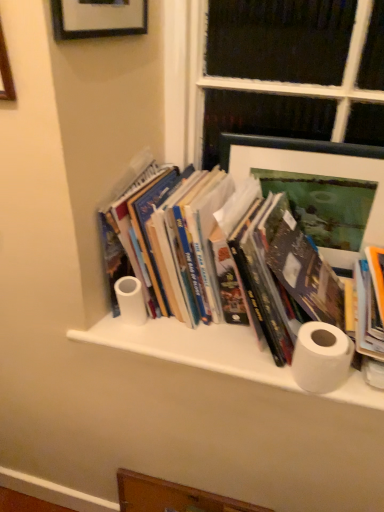
Question: Can you confirm if matte green picture frame at upper right, the 2th picture frame positioned from the front, is positioned to the right of brushed metal picture frame at upper left, the second picture frame from the bottom?

Choices:
 (A) no
 (B) yes

Answer: (B)

Question: Is matte green picture frame at upper right, which is counted as the first picture frame, starting from the right, located outside brushed metal picture frame at upper left, the second picture frame from the bottom?

Choices:
 (A) yes
 (B) no

Answer: (A)

Question: Could you tell me if matte green picture frame at upper right, the 2th picture frame viewed from the top, is turned towards brushed metal picture frame at upper left, the second picture frame from the bottom?

Choices:
 (A) yes
 (B) no

Answer: (B)

Question: Is the position of matte green picture frame at upper right, which appears as the first picture frame when viewed from the back, less distant than that of brushed metal picture frame at upper left, acting as the second picture frame starting from the right?

Choices:
 (A) no
 (B) yes

Answer: (A)

Question: Can you confirm if matte green picture frame at upper right, which appears as the first picture frame when viewed from the back, is taller than brushed metal picture frame at upper left, which is the first picture frame from left to right?

Choices:
 (A) yes
 (B) no

Answer: (B)

Question: From the image's perspective, is matte green picture frame at upper right, the 2th picture frame viewed from the top, above brushed metal picture frame at upper left, which is the first picture frame from left to right?

Choices:
 (A) no
 (B) yes

Answer: (A)

Question: From a real-world perspective, is white matte cabinet at center under white matte toilet paper at center, the 2th toilet paper viewed from the right?

Choices:
 (A) yes
 (B) no

Answer: (A)

Question: From a real-world perspective, is white matte cabinet at center on top of white matte toilet paper at center, the 2th toilet paper viewed from the front?

Choices:
 (A) no
 (B) yes

Answer: (A)

Question: Is white matte cabinet at center to the right of white matte toilet paper at center, the first toilet paper viewed from the left, from the viewer's perspective?

Choices:
 (A) no
 (B) yes

Answer: (B)

Question: Considering the relative sizes of white matte cabinet at center and white matte toilet paper at center, the 2th toilet paper viewed from the front, in the image provided, is white matte cabinet at center taller than white matte toilet paper at center, the 2th toilet paper viewed from the front,?

Choices:
 (A) yes
 (B) no

Answer: (B)

Question: Does white matte cabinet at center contain white matte toilet paper at center, the 2th toilet paper viewed from the front?

Choices:
 (A) yes
 (B) no

Answer: (B)

Question: Is white matte cabinet at center further to camera compared to white matte toilet paper at center, the first toilet paper viewed from the left?

Choices:
 (A) yes
 (B) no

Answer: (B)

Question: From the image's perspective, is hardcover books at center on top of matte green picture frame at upper right, which ranks as the 2th picture frame in left-to-right order?

Choices:
 (A) no
 (B) yes

Answer: (A)